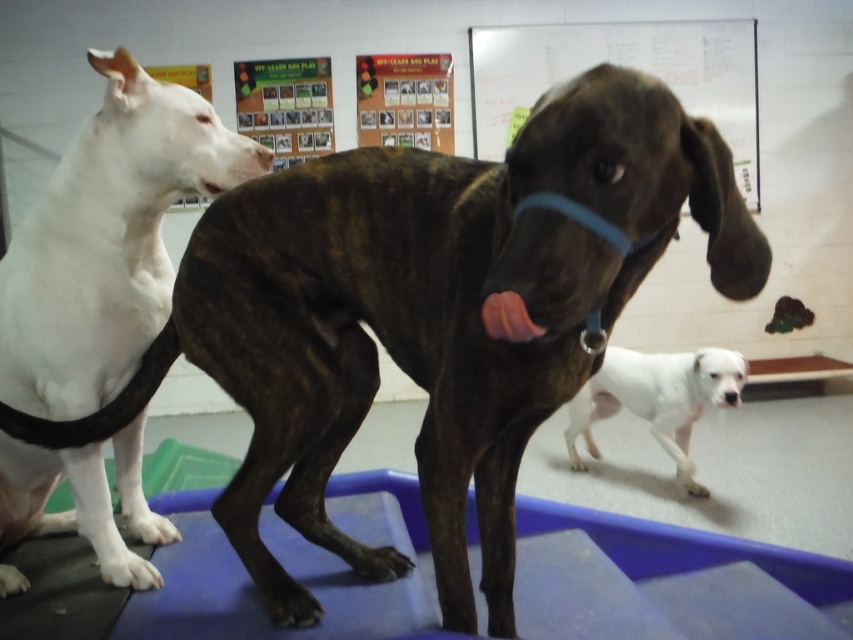
You are a dog trainer who needs to place a 2.5 feet wide training mat between the whiteboard at upper center and the white smooth dog at lower right. Can you fit it without overlapping either object?

The distance between the whiteboard at upper center and the white smooth dog at lower right is 6.35 feet, which is approximately 76.2 inches. The training mat is 2.5 feet wide, which is 30 inches. Since 76.2 inches is greater than 30 inches, the training mat can fit between them without overlapping either object.